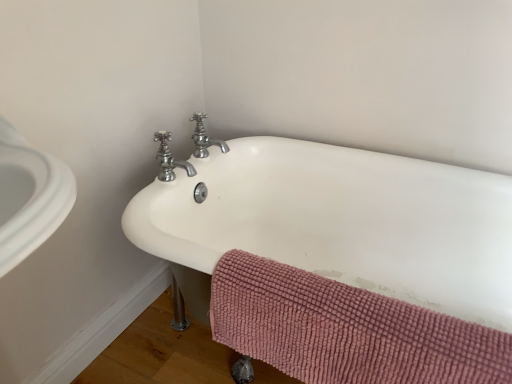
Question: Relative to pink chenille bath towel at lower right, is polished chrome faucet at upper center, which appears as the 1th tap when viewed from the back, in front or behind?

Choices:
 (A) front
 (B) behind

Answer: (B)

Question: Does point (x=198, y=142) appear closer or farther from the camera than point (x=508, y=349)?

Choices:
 (A) farther
 (B) closer

Answer: (A)

Question: Which is nearer to the polished chrome faucet at upper center, arranged as the second tap when viewed from the back?

Choices:
 (A) polished chrome faucet at upper center, which appears as the 1th tap when viewed from the back
 (B) white ceramic bathtub at center
 (C) pink chenille bath towel at lower right

Answer: (A)

Question: Which object is positioned farthest from the polished chrome faucet at upper center, the second tap when ordered from front to back?

Choices:
 (A) white ceramic bathtub at center
 (B) polished chrome faucet at upper center, which ranks as the 1th tap in front-to-back order
 (C) pink chenille bath towel at lower right

Answer: (C)